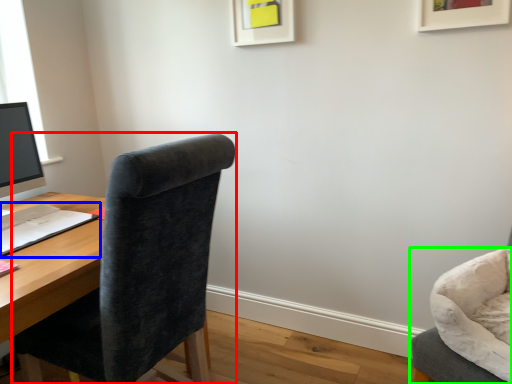
Question: Considering the real-world distances, which object is farthest from chair (highlighted by a red box)? notepad (highlighted by a blue box) or chair (highlighted by a green box)?

Choices:
 (A) notepad
 (B) chair

Answer: (B)